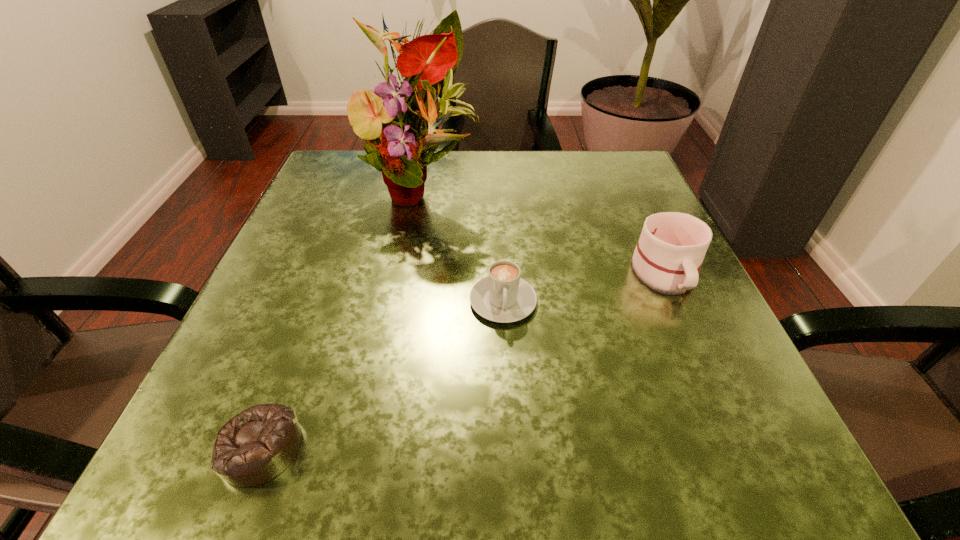
Locate an element on the screen. The image size is (960, 540). vacant space located 0.070m on the right of the shortest object is located at coordinates (356, 447).

Identify the location of object present at the far edge. This screenshot has width=960, height=540. (428, 63).

Identify the location of object present at the near edge. (258, 444).

Identify the location of bouquet that is at the left edge. (428, 63).

In order to click on beanbag present at the left edge in this screenshot , I will do `click(258, 444)`.

In order to click on object situated at the right edge in this screenshot , I will do `click(668, 256)`.

The width and height of the screenshot is (960, 540). Find the location of `object present at the far left corner`. object present at the far left corner is located at coordinates (428, 63).

Locate an element on the screen. This screenshot has height=540, width=960. object that is at the near left corner is located at coordinates (258, 444).

This screenshot has width=960, height=540. I want to click on vacant space at the far edge, so click(x=569, y=187).

Where is `vacant space at the left edge`? The width and height of the screenshot is (960, 540). vacant space at the left edge is located at coordinates (298, 365).